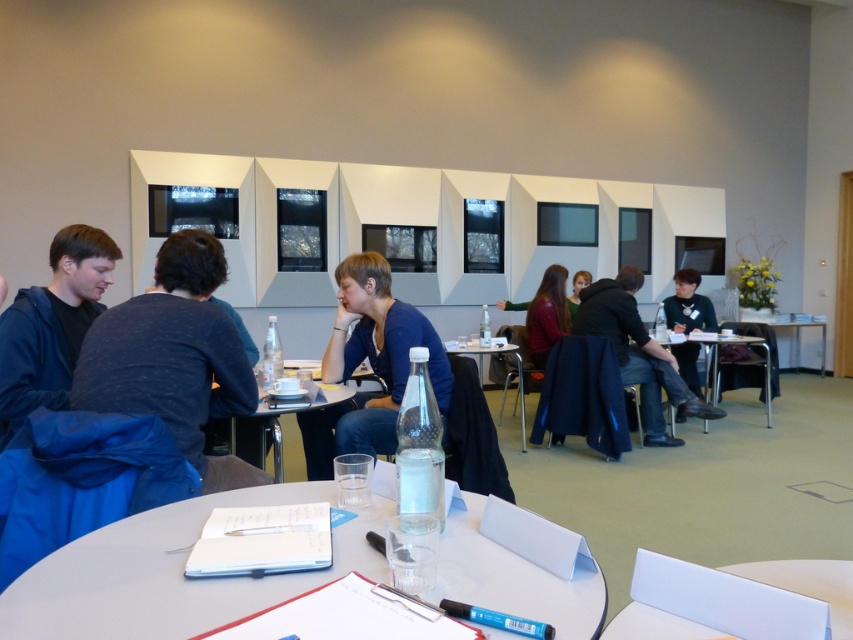
You are organizing a meeting in this conference room and need to place a name tag on the clear plastic table at center. However, there is already a dark blue sweater at center on the table. Where should you place the name tag?

The dark blue sweater at center is to the right of the clear plastic table at center, so you should place the name tag on the left side of the clear plastic table at center to avoid overlapping with the sweater.

You are standing at the entrance of the conference room and see a point marked at coordinates (688, 305). Which object is this point located on?

The point at coordinates (688, 305) is located on the dark blue sweater at center.

You are organizing a small event and need to place a 1.5 meter wide banner between the clear glass table at center and the matte black dress at center. Can the space between them accommodate the banner?

The clear glass table at center is bigger than the matte black dress at center. Therefore, the space between them may not be sufficient to fit a 1.5 meter wide banner. You should consider a smaller banner or reposition the items to create more space.